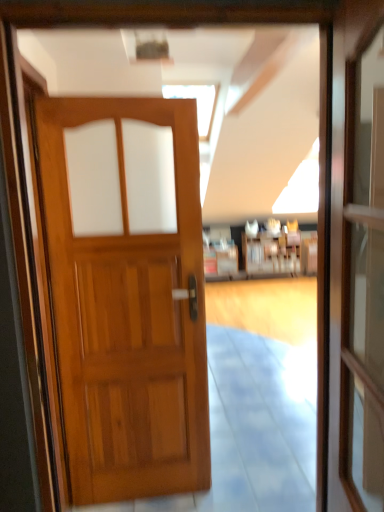
Question: Should I look upward or downward to see wooden bookshelf at center?

Choices:
 (A) down
 (B) up

Answer: (B)

Question: Does wooden bookshelf at center appear on the right side of wooden door at center?

Choices:
 (A) yes
 (B) no

Answer: (A)

Question: From a real-world perspective, is wooden bookshelf at center beneath wooden door at center?

Choices:
 (A) yes
 (B) no

Answer: (A)

Question: Can you confirm if wooden bookshelf at center is taller than wooden door at center?

Choices:
 (A) yes
 (B) no

Answer: (B)

Question: Does wooden bookshelf at center appear on the left side of wooden door at center?

Choices:
 (A) yes
 (B) no

Answer: (B)

Question: From the image's perspective, does wooden bookshelf at center appear lower than wooden door at center?

Choices:
 (A) yes
 (B) no

Answer: (B)

Question: Is wooden bookshelf at center in front of wooden door at center?

Choices:
 (A) yes
 (B) no

Answer: (B)

Question: Does transparent glass screen door at right appear on the left side of wooden bookshelf at center?

Choices:
 (A) yes
 (B) no

Answer: (A)

Question: Is the position of transparent glass screen door at right more distant than that of wooden bookshelf at center?

Choices:
 (A) yes
 (B) no

Answer: (B)

Question: Does transparent glass screen door at right have a greater height compared to wooden bookshelf at center?

Choices:
 (A) yes
 (B) no

Answer: (A)

Question: Is wooden bookshelf at center completely or partially inside transparent glass screen door at right?

Choices:
 (A) no
 (B) yes

Answer: (A)

Question: From the image's perspective, is transparent glass screen door at right on wooden bookshelf at center?

Choices:
 (A) no
 (B) yes

Answer: (A)

Question: Can you confirm if transparent glass screen door at right is bigger than wooden bookshelf at center?

Choices:
 (A) no
 (B) yes

Answer: (A)

Question: Is wooden bookshelf at center positioned far away from transparent glass screen door at right?

Choices:
 (A) yes
 (B) no

Answer: (A)